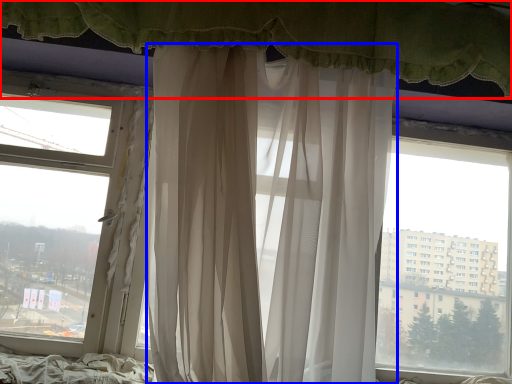
Question: Which of the following is the closest to the observer, curtain (highlighted by a red box) or curtain (highlighted by a blue box)?

Choices:
 (A) curtain
 (B) curtain

Answer: (B)